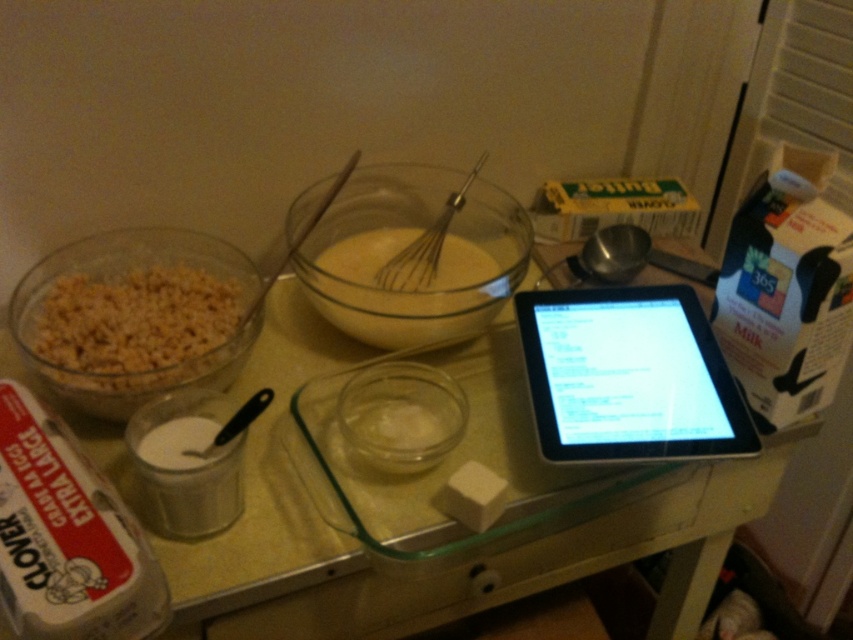
The height and width of the screenshot is (640, 853). What do you see at coordinates (405, 246) in the screenshot?
I see `transparent glass bowl at center` at bounding box center [405, 246].

Does transparent glass bowl at center appear over metallic whisk at center?

No.

Is point (442, 260) closer to camera compared to point (426, 244)?

No.

Locate an element on the screen. transparent glass bowl at center is located at coordinates (405, 246).

Which is above, translucent glass tray at center or black glossy tablet at upper right?

Positioned higher is black glossy tablet at upper right.

Between point (677, 499) and point (680, 332), which one is positioned in front?

Positioned in front is point (680, 332).

Identify the location of translucent glass tray at center. (360, 541).

Is black glossy tablet at upper right above brown crunchy cereal at left?

No.

How distant is black glossy tablet at upper right from brown crunchy cereal at left?

The distance of black glossy tablet at upper right from brown crunchy cereal at left is 16.06 inches.

Measure the distance between black glossy tablet at upper right and camera.

black glossy tablet at upper right and camera are 28.55 inches apart.

Identify the location of black glossy tablet at upper right. This screenshot has width=853, height=640. (628, 376).